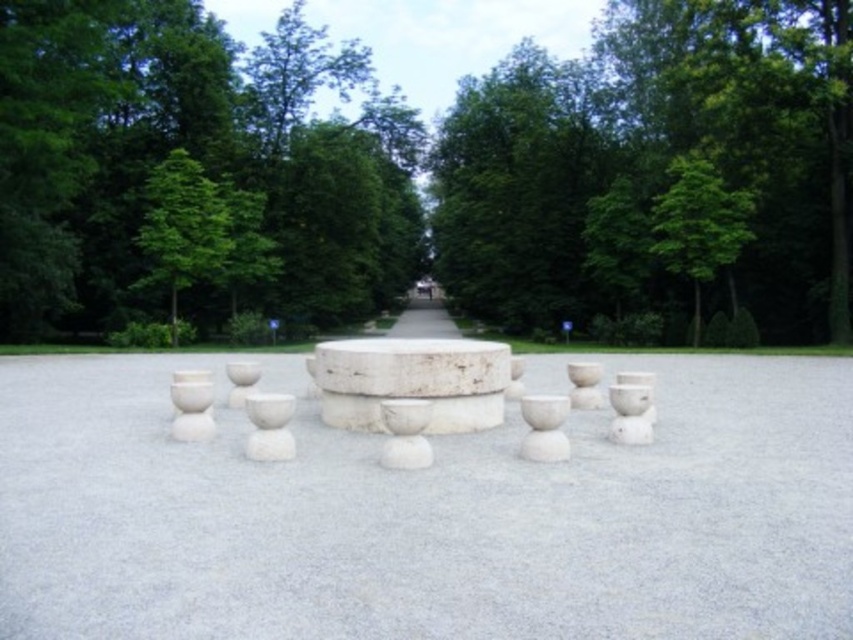
You are standing in the outdoor scene and want to know if the white stone table at center is under the shade of the green leafy tree at upper center. Can you determine this based on their positions?

The white stone table at center is below the green leafy tree at upper center, so it is likely in the shade cast by the tree.

You are standing in the outdoor scene and want to place a decorative item between the white stone table at center and the green leafy tree at upper right. Based on their positions, which object should you place the item closer to?

The white stone table at center is positioned on the left side of green leafy tree at upper right, so you should place the decorative item closer to the white stone table at center to maintain symmetry between them.